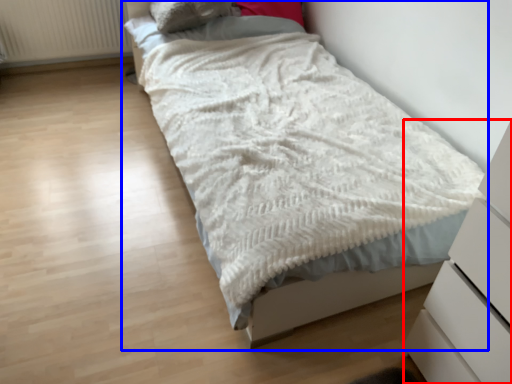
Question: Which object appears farthest to the camera in this image, chest of drawers (highlighted by a red box) or bed (highlighted by a blue box)?

Choices:
 (A) chest of drawers
 (B) bed

Answer: (B)